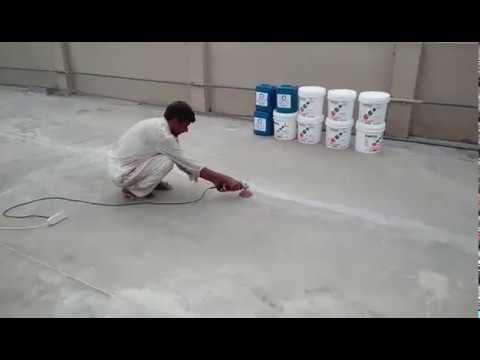
The image size is (480, 360). I want to click on pipe running along the wall, so click(217, 84).